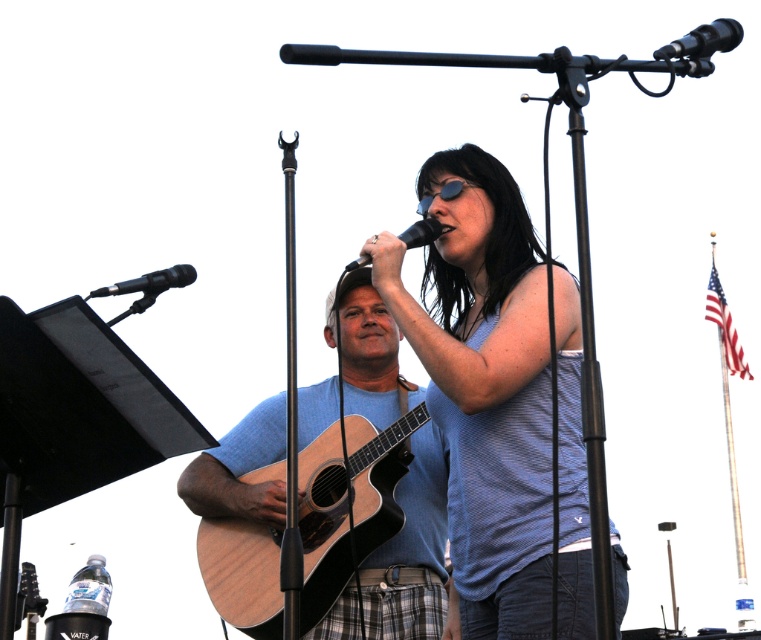
What do you see at coordinates (346, 500) in the screenshot? This screenshot has width=761, height=640. I see `natural wood acoustic guitar at center` at bounding box center [346, 500].

Can you confirm if natural wood acoustic guitar at center is bigger than black matte microphone at upper right?

Yes, natural wood acoustic guitar at center is bigger than black matte microphone at upper right.

Find the location of a particular element. natural wood acoustic guitar at center is located at coordinates pos(346,500).

Does point (158, 275) lie behind point (346, 269)?

No.

Which of these two, black matte microphone at upper left or black matte microphone at center, stands shorter?

black matte microphone at center

Between point (139, 289) and point (435, 234), which one is positioned in front?

Point (139, 289) is more forward.

What are the coordinates of `black matte microphone at upper left` in the screenshot? It's located at (150, 282).

Which is in front, point (672, 49) or point (346, 272)?

Positioned in front is point (672, 49).

Is black matte microphone at upper right thinner than black matte microphone at center?

No, black matte microphone at upper right is not thinner than black matte microphone at center.

Does point (712, 42) come farther from viewer compared to point (432, 230)?

That is False.

Find the location of a particular element. black matte microphone at upper right is located at coordinates (702, 40).